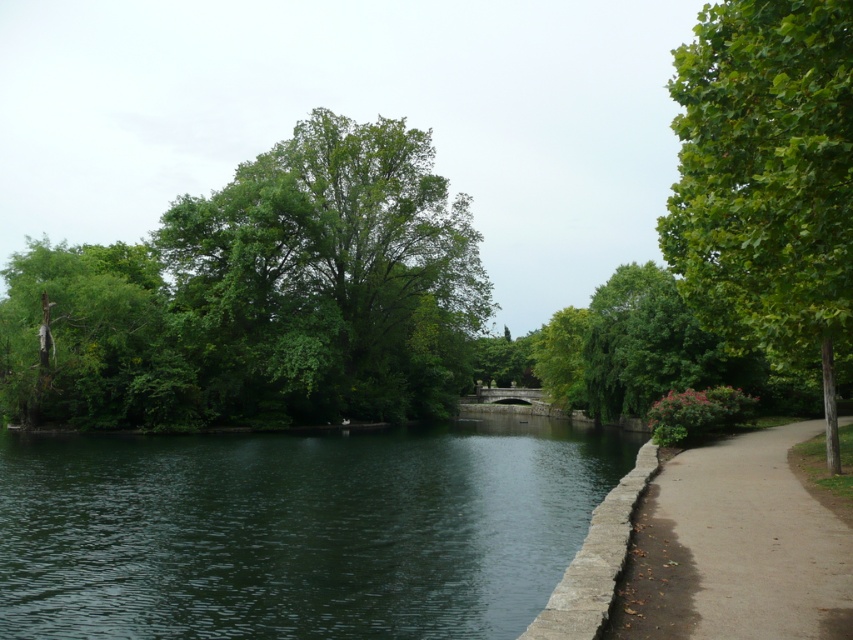
Is green leafy tree at center positioned before concrete sidewalk at right?

That is False.

Is green leafy tree at center shorter than concrete sidewalk at right?

No.

Identify the location of green leafy tree at center. This screenshot has height=640, width=853. (328, 280).

Who is positioned more to the left, green leafy tree at center or green leafy tree at right?

From the viewer's perspective, green leafy tree at center appears more on the left side.

Does green leafy tree at center have a lesser height compared to green leafy tree at right?

No, green leafy tree at center is not shorter than green leafy tree at right.

Describe the element at coordinates (328, 280) in the screenshot. I see `green leafy tree at center` at that location.

Locate an element on the screen. This screenshot has width=853, height=640. green leafy tree at center is located at coordinates (328, 280).

Who is positioned more to the left, dark green water at center or green leafy tree at right?

dark green water at center

Which is below, dark green water at center or green leafy tree at right?

Positioned lower is dark green water at center.

This screenshot has width=853, height=640. Find the location of `dark green water at center`. dark green water at center is located at coordinates (297, 529).